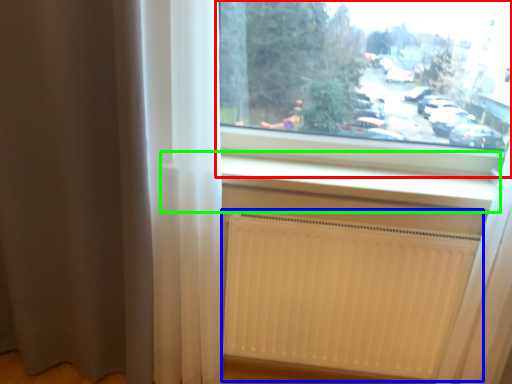
Question: Which object is positioned farthest from window (highlighted by a red box)? Select from radiator (highlighted by a blue box) and window sill (highlighted by a green box).

Choices:
 (A) radiator
 (B) window sill

Answer: (A)